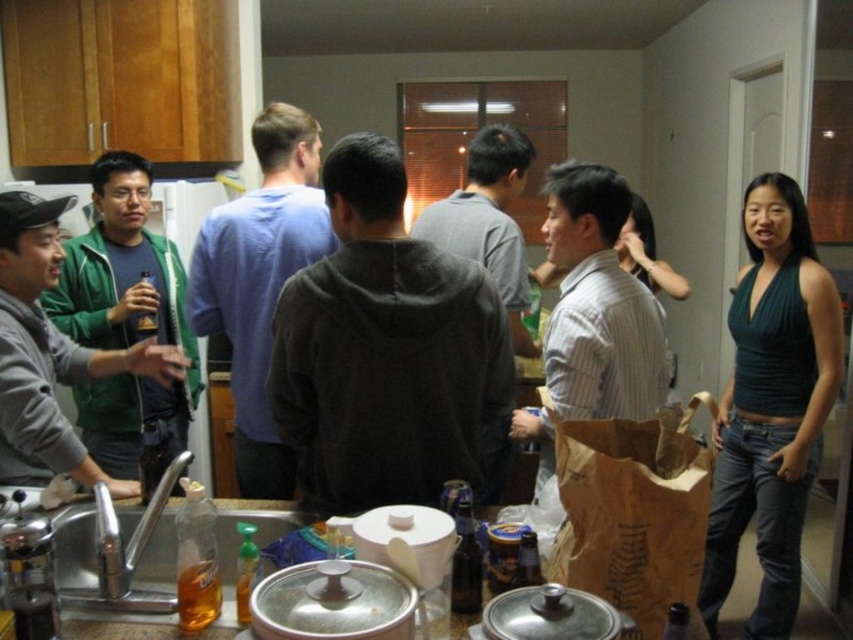
Is dark gray hoodie at center taller than blue cotton shirt at center?

Result: No.

Is dark gray hoodie at center to the right of blue cotton shirt at center from the viewer's perspective?

Yes, dark gray hoodie at center is to the right of blue cotton shirt at center.

Who is more distant from viewer, (x=355, y=264) or (x=257, y=378)?

The point (x=257, y=378) is behind.

You are a GUI agent. You are given a task and a screenshot of the screen. Output one action in this format:
    pyautogui.click(x=<x>, y=<y>)
    Task: Click on the dark gray hoodie at center
    Image resolution: width=853 pixels, height=640 pixels.
    Given the screenshot: What is the action you would take?
    pyautogui.click(x=387, y=353)

In the scene shown: Is brown paper bag at center behind translucent glass bottle at center?

That is False.

Is point (567, 428) farther from camera compared to point (466, 557)?

Yes, point (567, 428) is farther from viewer.

Is point (619, 596) farther from camera compared to point (465, 609)?

That is False.

You are a GUI agent. You are given a task and a screenshot of the screen. Output one action in this format:
    pyautogui.click(x=<x>, y=<y>)
    Task: Click on the brown paper bag at center
    This screenshot has width=853, height=640.
    Given the screenshot: What is the action you would take?
    pyautogui.click(x=633, y=513)

Between blue cotton shirt at center and translucent plastic bottle at lower left, which one is positioned higher?

Positioned higher is blue cotton shirt at center.

The image size is (853, 640). Identify the location of blue cotton shirt at center. (260, 282).

I want to click on blue cotton shirt at center, so click(x=260, y=282).